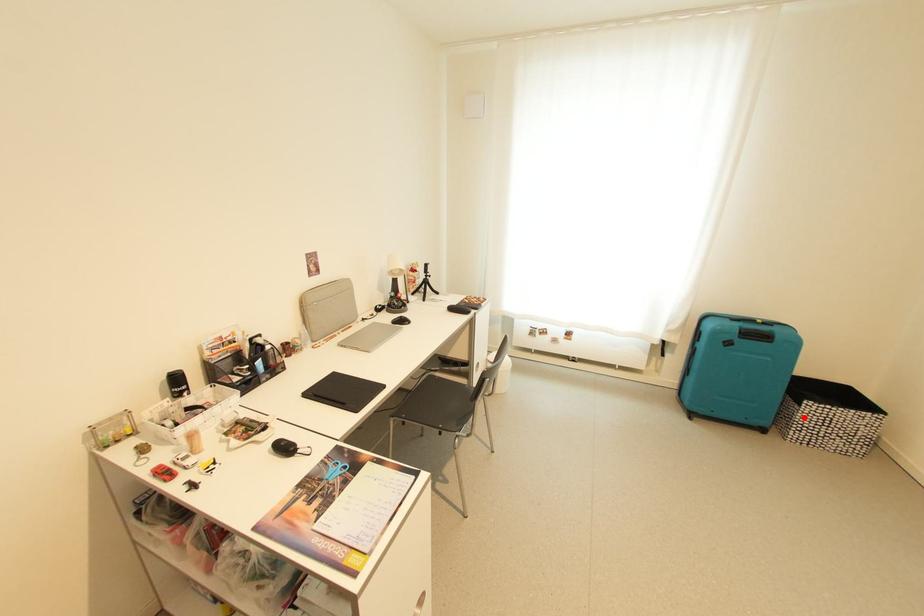
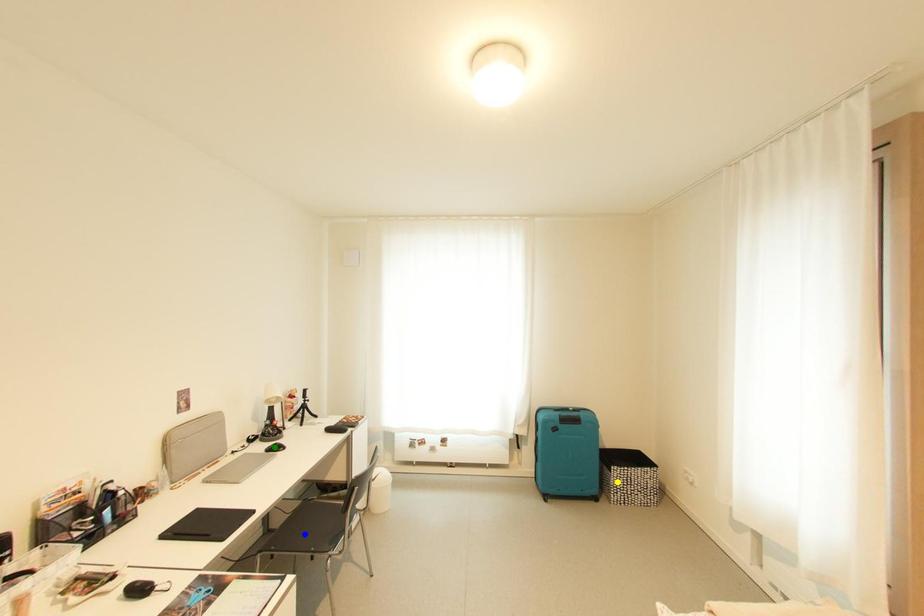
Question: I am providing you with two images of the same scene from different viewpoints. A red point is marked on the first image. You are given multiple points on the second image. Which spot in image 2 lines up with the point in image 1?

Choices:
 (A) yellow point
 (B) blue point
 (C) green point

Answer: (A)